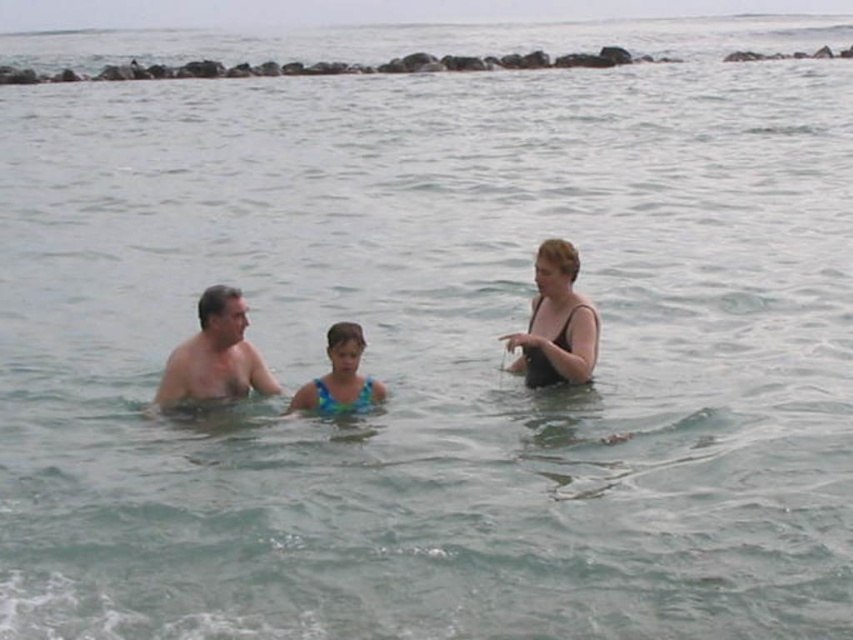
You are a lifeguard observing the scene. You notice two individuals at the center wearing swimsuits. The first is wearing a blue printed swimsuit at center, and the second is wearing a blue textured swimsuit at center. Which swimmer has a larger swimsuit?

The blue printed swimsuit at center is bigger than the blue textured swimsuit at center, so the swimmer wearing the blue printed swimsuit at center has a larger swimsuit.

You are a lifeguard on duty and notice two individuals in the water. You see the blue printed swimsuit at center and the blue textured swimsuit at center. Which swimmer is taller?

The blue printed swimsuit at center is much taller than the blue textured swimsuit at center.

You are a photographer trying to capture a group photo of the skinny white man at left and the black matte swimsuit at center. Since you want both subjects to be in focus, you need to adjust your camera settings. Considering their positions, which subject is closer to you, the photographer, so you can set the focus accordingly?

The skinny white man at left is behind the black matte swimsuit at center, so the black matte swimsuit at center is closer to you. Set the focus on the black matte swimsuit at center to ensure both are in focus.